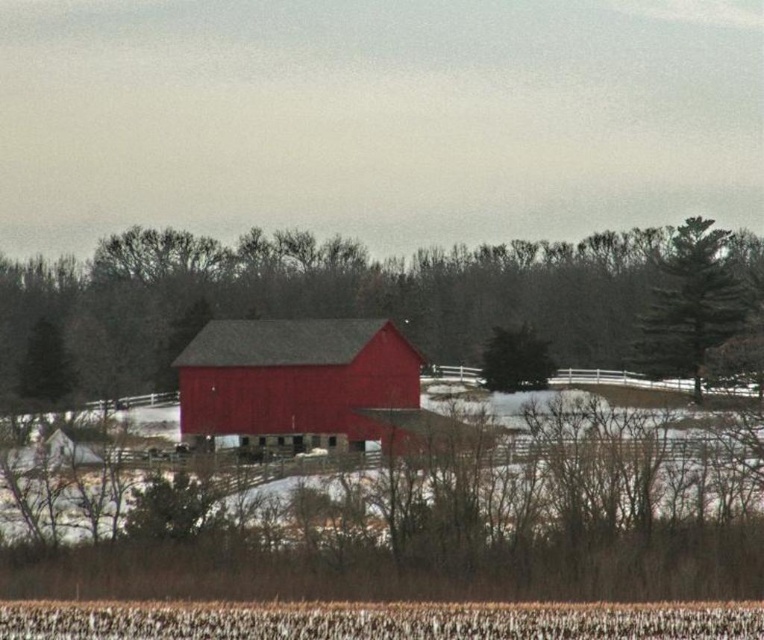
Locate an element on the screen. smooth bark tree at center is located at coordinates (324, 298).

Between point (351, 244) and point (497, 336), which one is positioned behind?

The point (351, 244) is more distant.

What are the coordinates of `smooth bark tree at center` in the screenshot? It's located at (324, 298).

Who is higher up, smooth bark tree at center or green textured tree at upper right?

smooth bark tree at center is above.

Who is more forward, (622, 356) or (694, 320)?

Point (694, 320) is in front.

Is point (610, 264) more distant than point (685, 256)?

Yes, it is behind point (685, 256).

This screenshot has height=640, width=764. Identify the location of smooth bark tree at center. (324, 298).

Is smooth bark tree at center bigger than matte red barn at center?

Indeed, smooth bark tree at center has a larger size compared to matte red barn at center.

Who is positioned more to the right, smooth bark tree at center or matte red barn at center?

smooth bark tree at center is more to the right.

In order to click on smooth bark tree at center in this screenshot , I will do `click(324, 298)`.